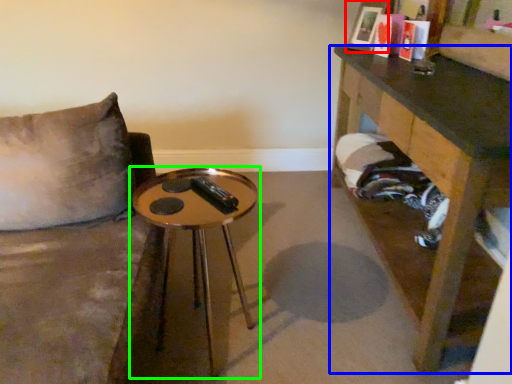
Question: Which object is the closest to the picture frame (highlighted by a red box)? Choose among these: table (highlighted by a blue box) or table (highlighted by a green box).

Choices:
 (A) table
 (B) table

Answer: (A)